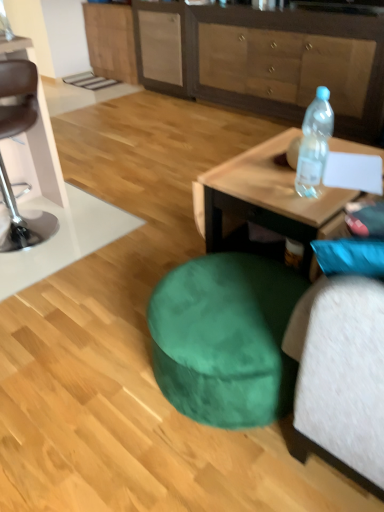
Identify the location of free space to the left of transparent plastic bottle at upper right. The height and width of the screenshot is (512, 384). (269, 187).